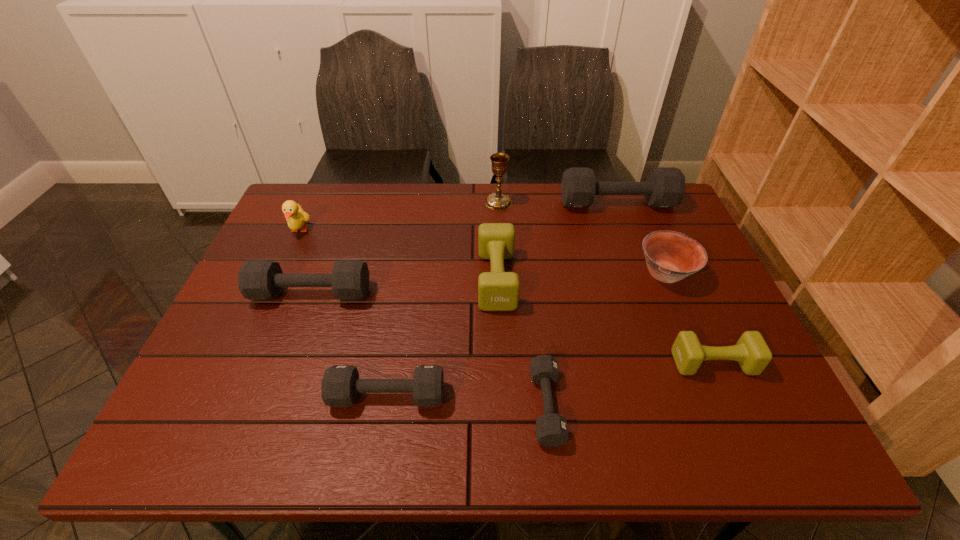
Locate an element on the screen. The image size is (960, 540). the tallest object is located at coordinates (498, 201).

Locate an element on the screen. the rightmost gray dumbbell is located at coordinates (665, 186).

At what (x,y) coordinates should I click in order to perform the action: click on the biggest gray dumbbell. Please return your answer as a coordinate pair (x, y). The image size is (960, 540). Looking at the image, I should click on (665, 186).

At what (x,y) coordinates should I click in order to perform the action: click on the third farthest object. Please return your answer as a coordinate pair (x, y). Image resolution: width=960 pixels, height=540 pixels. Looking at the image, I should click on (295, 216).

You are a GUI agent. You are given a task and a screenshot of the screen. Output one action in this format:
    pyautogui.click(x=<x>, y=<y>)
    Task: Click on the duckling
    
    Given the screenshot: What is the action you would take?
    pyautogui.click(x=295, y=216)

Locate an element on the screen. The height and width of the screenshot is (540, 960). the bigger olive dumbbell is located at coordinates point(498,290).

Locate an element on the screen. Image resolution: width=960 pixels, height=540 pixels. the farther olive dumbbell is located at coordinates (498, 290).

Image resolution: width=960 pixels, height=540 pixels. In order to click on the third smallest gray dumbbell in this screenshot , I will do `click(257, 279)`.

I want to click on bowl, so click(x=670, y=256).

Where is `the second smallest gray dumbbell`? the second smallest gray dumbbell is located at coordinates (340, 385).